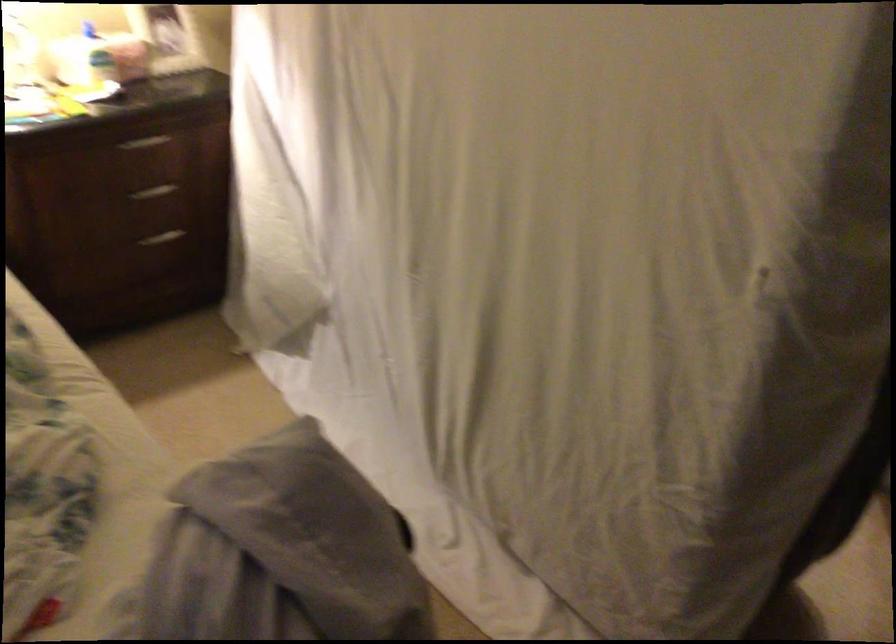
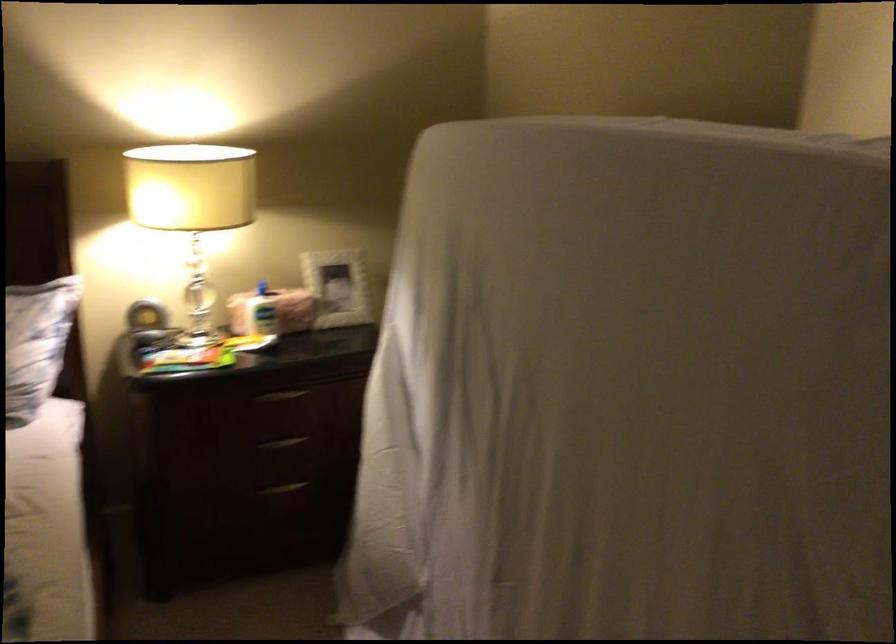
Locate, in the second image, the point that corresponds to (143,145) in the first image.

(280, 395)